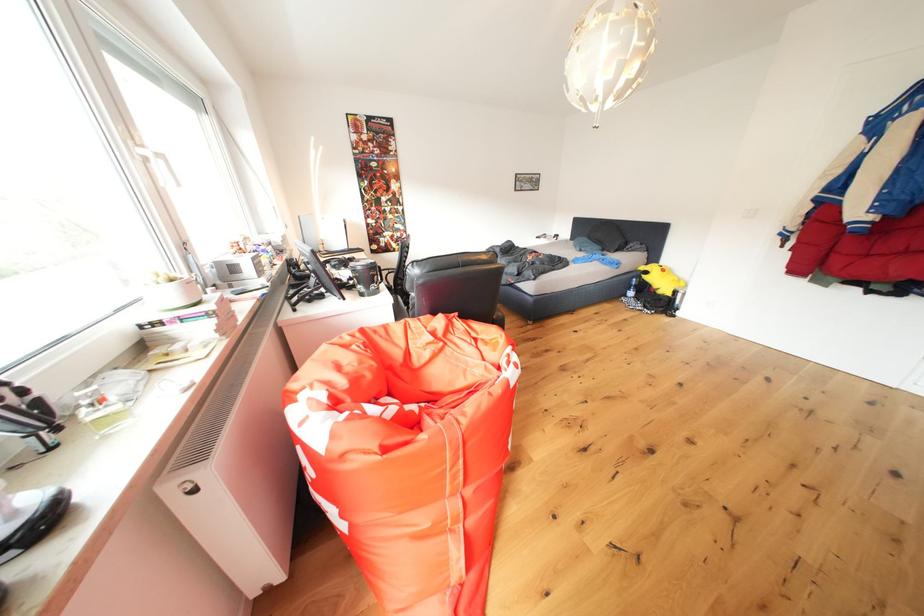
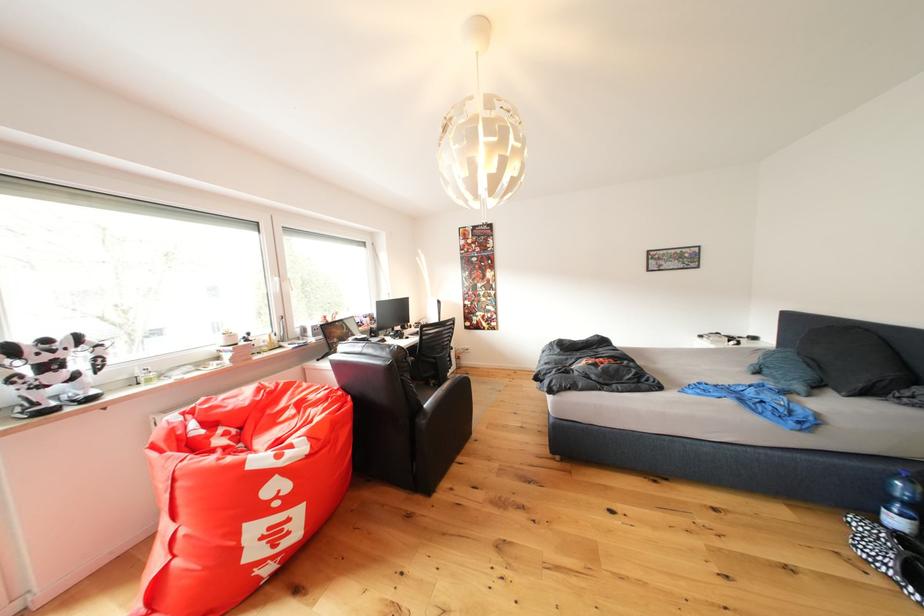
Where in the second image is the point corresponding to [633,304] from the first image?

(864, 527)